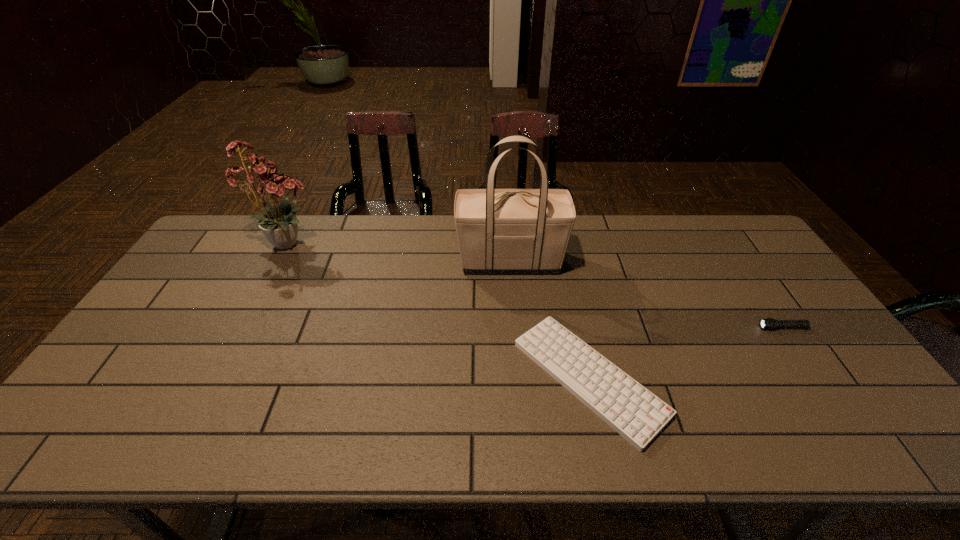
The image size is (960, 540). I want to click on free spot located at the lens end of the rightmost object, so click(x=712, y=327).

Where is `blank area located on the left of the computer keyboard`? blank area located on the left of the computer keyboard is located at coordinates (390, 378).

Find the location of `shopping bag that is at the far edge`. shopping bag that is at the far edge is located at coordinates (500, 231).

Locate an element on the screen. This screenshot has width=960, height=540. flower arrangement located in the far edge section of the desktop is located at coordinates click(280, 224).

Where is `object situated at the near edge`? object situated at the near edge is located at coordinates (634, 412).

Locate an element on the screen. The height and width of the screenshot is (540, 960). object that is positioned at the left edge is located at coordinates (280, 224).

The height and width of the screenshot is (540, 960). I want to click on object that is positioned at the right edge, so click(x=769, y=323).

Image resolution: width=960 pixels, height=540 pixels. In order to click on object that is at the far left corner in this screenshot , I will do `click(280, 224)`.

Where is `free space at the far edge`? The height and width of the screenshot is (540, 960). free space at the far edge is located at coordinates (670, 230).

What are the coordinates of `free space at the left edge of the desktop` in the screenshot? It's located at (198, 322).